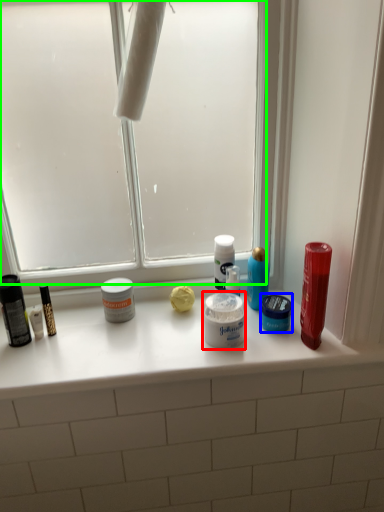
Question: Considering the real-world distances, which object is farthest from cream (highlighted by a red box)? toiletry (highlighted by a blue box) or window screen (highlighted by a green box)?

Choices:
 (A) toiletry
 (B) window screen

Answer: (B)